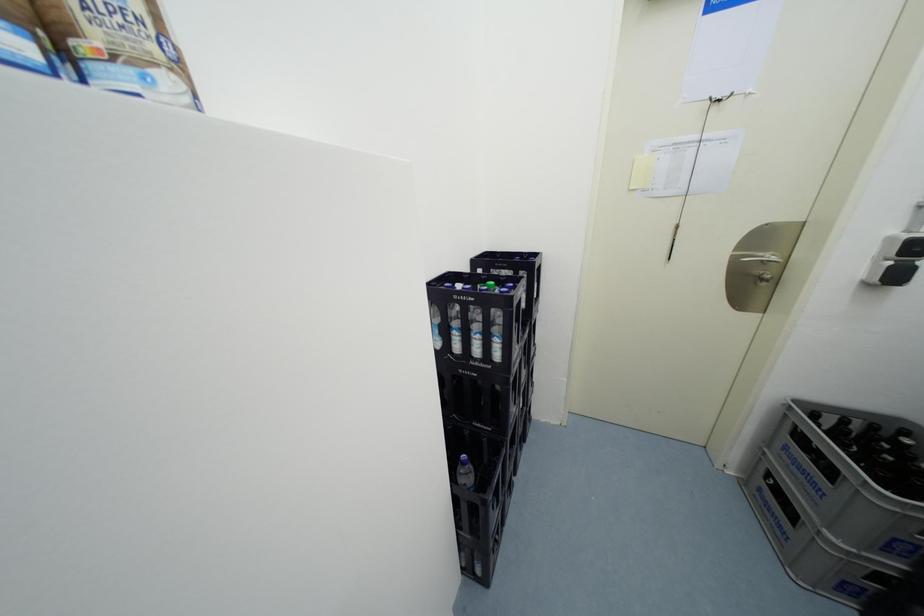
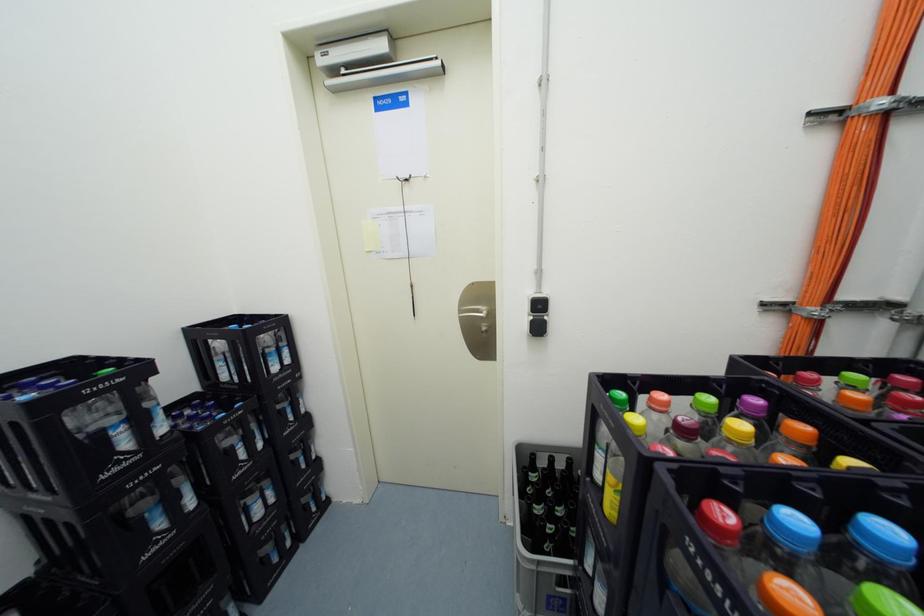
Question: The images are taken continuously from a first-person perspective. In which direction are you moving?

Choices:
 (A) Left
 (B) Right
 (C) Forward
 (D) Backward

Answer: (B)